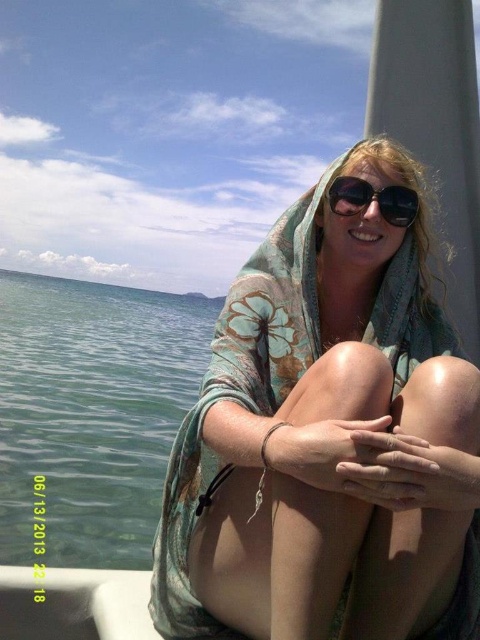
You are a photographer trying to capture the clear blue water at left and the sunglasses at center. Which object will occupy more space in your photo?

The clear blue water at left is larger in size than sunglasses at center, so it will occupy more space in the photo.

You are a photographer taking a portrait of the person in the boat. You need to ensure that the floral chiffon scarf at center and the sunglasses at center are both clearly visible in the frame. Given that your camera has a minimum focus distance of 30 inches, will you be able to focus on both objects simultaneously?

The floral chiffon scarf at center is 31.40 inches from sunglasses at center. Since the minimum focus distance of the camera is 30 inches, the distance between the two objects is just over the minimum requirement, so the camera can focus on both objects simultaneously.

You are navigating a small drone that needs to fly from point A to point B in the scene. Point A is at coordinates point (457, 627) and point B is at coordinates point (79, 337). According to the scene description, which point is closer to the observer, point A or point B?

Point (457, 627) is in front of point (79, 337), so point A is closer to the observer.